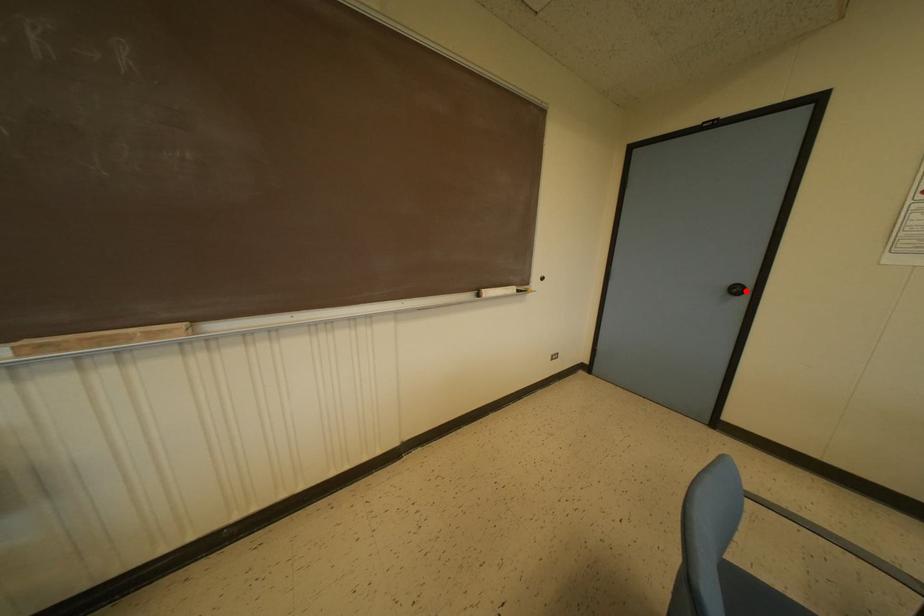
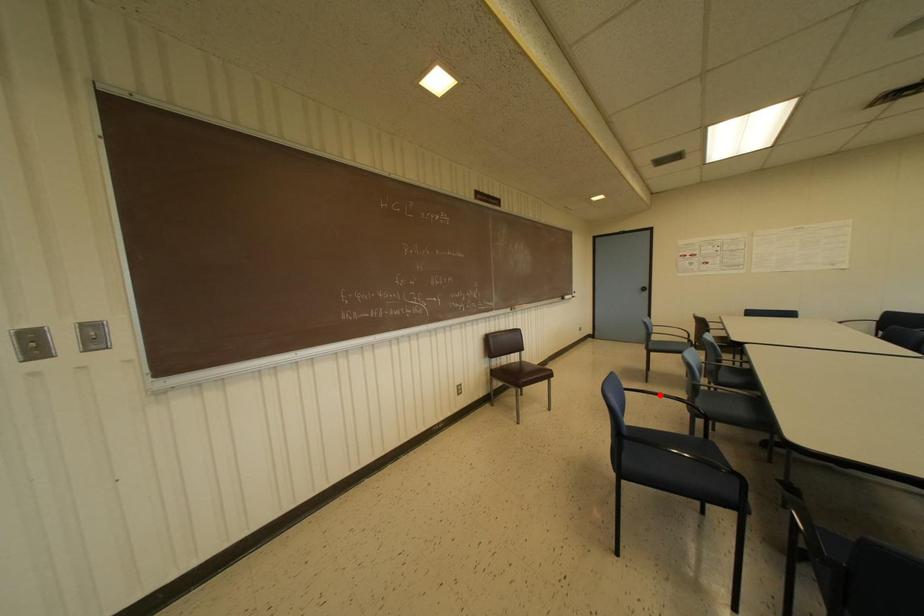
I am providing you with two images of the same scene from different viewpoints. A red point is marked on the first image and another point is marked on the second image. Are the points marked in image1 and image2 representing the same 3D position?

No